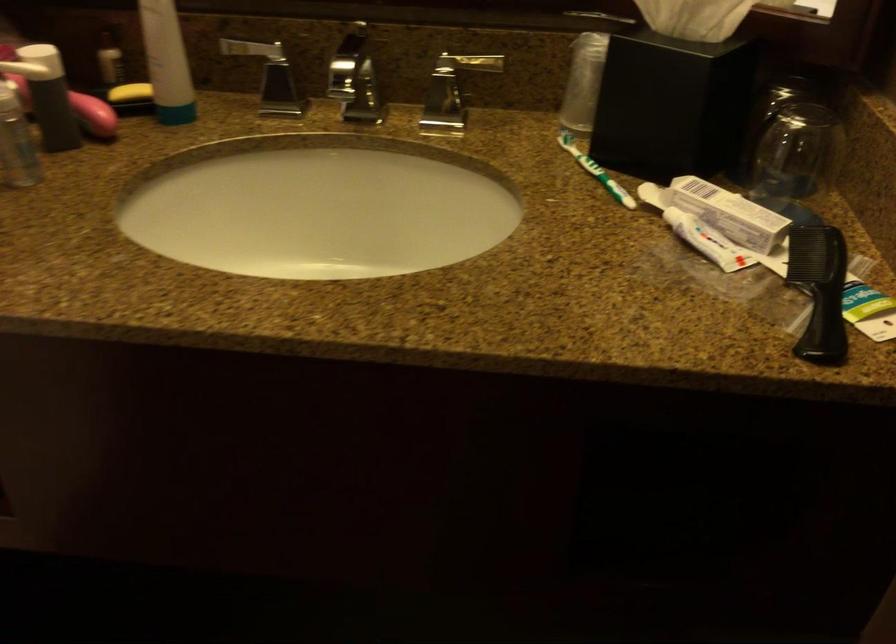
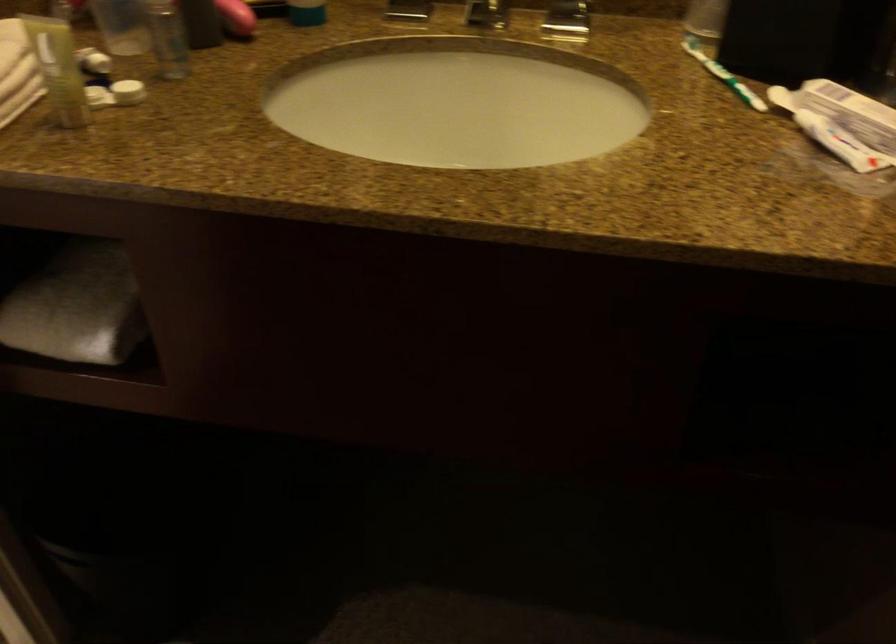
In the second image, find the point that corresponds to (442,114) in the first image.

(566, 21)